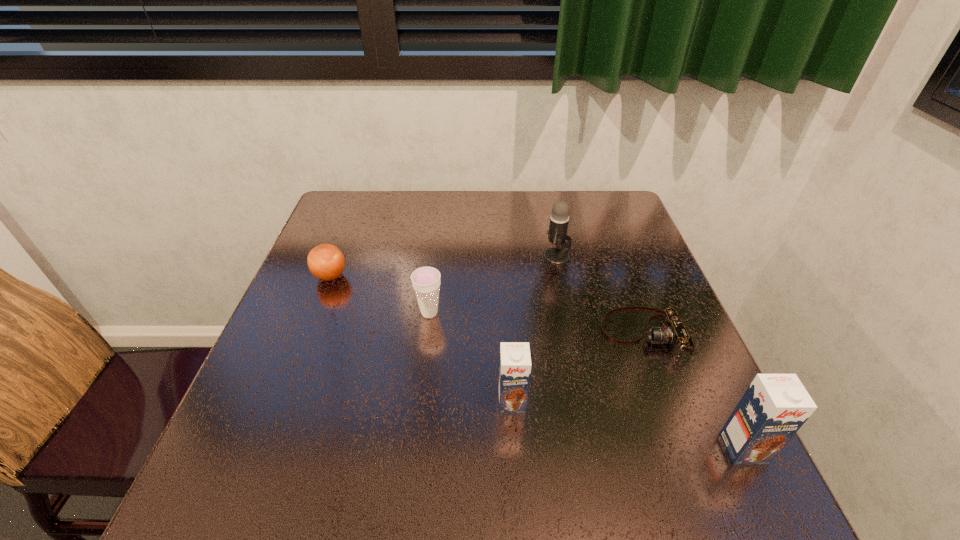
Where is `vacant area that lies between the fourth tallest object and the shortest object`? The image size is (960, 540). vacant area that lies between the fourth tallest object and the shortest object is located at coordinates (537, 323).

This screenshot has height=540, width=960. In order to click on vacant region between the orange and the fourth tallest object in this screenshot , I will do `click(380, 294)`.

What are the coordinates of `vacant space that's between the left chocolate milk and the fourth object from left to right` in the screenshot? It's located at (535, 329).

Where is `empty space that is in between the second nearest object and the taller chocolate milk`? The width and height of the screenshot is (960, 540). empty space that is in between the second nearest object and the taller chocolate milk is located at coordinates 628,425.

Where is `vacant area that lies between the fourth object from left to right and the taller chocolate milk`? vacant area that lies between the fourth object from left to right and the taller chocolate milk is located at coordinates (650, 353).

The height and width of the screenshot is (540, 960). Find the location of `vacant point located between the microphone and the shortest object`. vacant point located between the microphone and the shortest object is located at coordinates (601, 295).

The width and height of the screenshot is (960, 540). I want to click on vacant space that is in between the camera and the fourth object from left to right, so click(601, 295).

This screenshot has width=960, height=540. I want to click on vacant region between the camera and the left chocolate milk, so click(x=578, y=367).

Locate which object ranks second in proximity to the left chocolate milk. Please provide its 2D coordinates. Your answer should be formatted as a tuple, i.e. [(x, y)], where the tuple contains the x and y coordinates of a point satisfying the conditions above.

[(426, 280)]

Identify the location of object that ranks as the third closest to the orange. The image size is (960, 540). (557, 234).